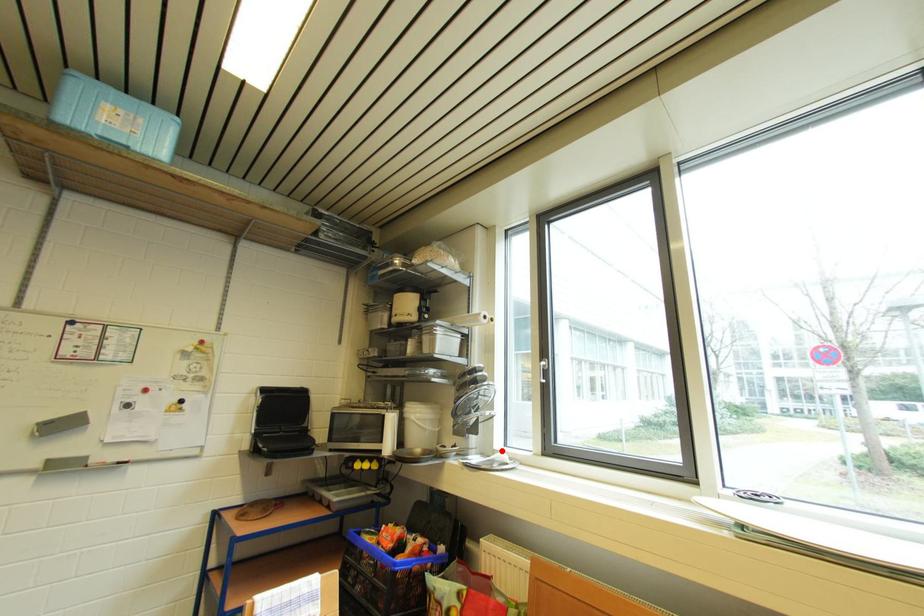
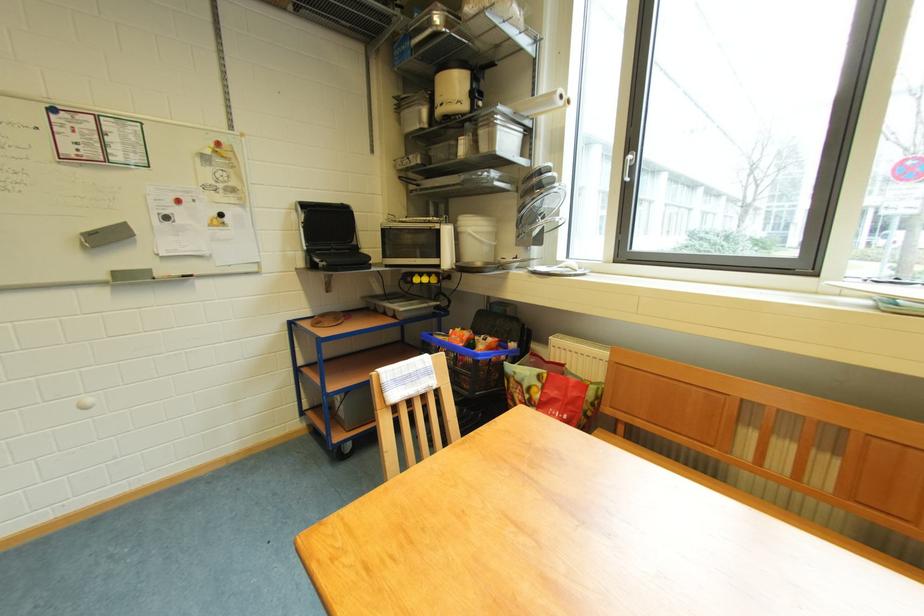
Question: A red point is marked in image1. In image2, is the corresponding 3D point closer to the camera or farther? Reply with the corresponding letter.

Choices:
 (A) The corresponding 3D point is closer.
 (B) The corresponding 3D point is farther.

Answer: (A)